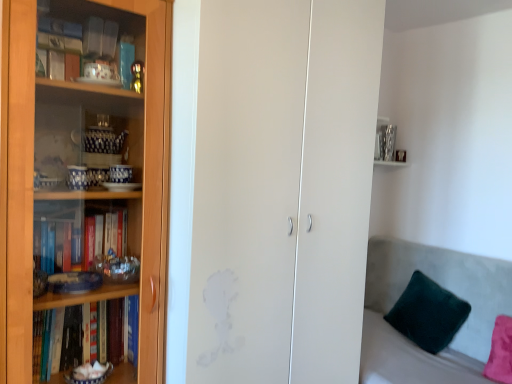
This screenshot has width=512, height=384. What do you see at coordinates (282, 189) in the screenshot?
I see `transparent glass cabinet at left` at bounding box center [282, 189].

The image size is (512, 384). I want to click on velvet grey couch at right, so click(442, 286).

Would you say velvety green pillow at lower right is inside or outside velvet grey couch at right?

velvety green pillow at lower right is located inside velvet grey couch at right.

Could you tell me if velvety green pillow at lower right is facing velvet grey couch at right?

Yes.

Looking at this image, from the image's perspective, which object appears higher, velvety green pillow at lower right or velvet grey couch at right?

From the image's view, velvety green pillow at lower right is above.

Considering the sizes of objects velvety green pillow at lower right and velvet grey couch at right in the image provided, who is thinner, velvety green pillow at lower right or velvet grey couch at right?

velvety green pillow at lower right.

Is wooden bookcase at left spatially inside velvet grey couch at right, or outside of it?

wooden bookcase at left cannot be found inside velvet grey couch at right.

Between wooden bookcase at left and velvet grey couch at right, which one has more height?

wooden bookcase at left is taller.

From the image's perspective, is wooden bookcase at left on top of velvet grey couch at right?

Yes, from the image's perspective, wooden bookcase at left is on top of velvet grey couch at right.

Which is more to the left, wooden bookcase at left or velvet grey couch at right?

From the viewer's perspective, wooden bookcase at left appears more on the left side.

From a real-world perspective, relative to velvet grey couch at right, is transparent glass cabinet at left vertically above or below?

transparent glass cabinet at left is situated higher than velvet grey couch at right in the real world.

Is transparent glass cabinet at left oriented away from velvet grey couch at right?

No, transparent glass cabinet at left is not facing away from velvet grey couch at right.

Which is nearer, (436, 283) or (217, 121)?

Clearly, point (436, 283) is more distant from the camera than point (217, 121).

Can you confirm if velvety green pillow at lower right is taller than transparent glass cabinet at left?

No, velvety green pillow at lower right is not taller than transparent glass cabinet at left.

Considering the relative sizes of velvety green pillow at lower right and transparent glass cabinet at left in the image provided, is velvety green pillow at lower right smaller than transparent glass cabinet at left?

Indeed, velvety green pillow at lower right has a smaller size compared to transparent glass cabinet at left.

Is velvety green pillow at lower right oriented towards transparent glass cabinet at left?

Yes, velvety green pillow at lower right is oriented towards transparent glass cabinet at left.

Is wooden bookcase at left wider or thinner than transparent glass cabinet at left?

In the image, wooden bookcase at left appears to be more narrow than transparent glass cabinet at left.

Based on their positions, is wooden bookcase at left located to the left or right of transparent glass cabinet at left?

Based on their positions, wooden bookcase at left is located to the left of transparent glass cabinet at left.

Which object is further away from the camera, wooden bookcase at left or transparent glass cabinet at left?

transparent glass cabinet at left is more distant.

Between point (162, 107) and point (298, 60), which one is positioned in front?

The point (162, 107) is in front.

Is velvet grey couch at right surrounding wooden bookcase at left?

Actually, wooden bookcase at left is outside velvet grey couch at right.

Does velvet grey couch at right turn towards wooden bookcase at left?

Yes, velvet grey couch at right is aimed at wooden bookcase at left.

From the image's perspective, is velvet grey couch at right over wooden bookcase at left?

No, from the image's perspective, velvet grey couch at right is not on top of wooden bookcase at left.

Considering the relative sizes of velvet grey couch at right and wooden bookcase at left in the image provided, is velvet grey couch at right taller than wooden bookcase at left?

No.

How many degrees apart are the facing directions of velvet grey couch at right and transparent glass cabinet at left?

The angular difference between velvet grey couch at right and transparent glass cabinet at left is 91.7 degrees.

Consider the image. Considering the relative sizes of velvet grey couch at right and transparent glass cabinet at left in the image provided, is velvet grey couch at right thinner than transparent glass cabinet at left?

No, velvet grey couch at right is not thinner than transparent glass cabinet at left.

I want to click on couch on the right of transparent glass cabinet at left, so click(442, 286).

Considering the sizes of objects velvet grey couch at right and transparent glass cabinet at left in the image provided, who is bigger, velvet grey couch at right or transparent glass cabinet at left?

transparent glass cabinet at left is bigger.

In order to click on couch below the velvety green pillow at lower right (from a real-world perspective) in this screenshot , I will do `click(442, 286)`.

Locate an element on the screen. This screenshot has height=384, width=512. couch located behind the wooden bookcase at left is located at coordinates (442, 286).

Which object lies further to the anchor point transparent glass cabinet at left, velvety green pillow at lower right or wooden bookcase at left?

Based on the image, velvety green pillow at lower right appears to be further to transparent glass cabinet at left.

Considering their positions, is velvety green pillow at lower right positioned closer to velvet grey couch at right than wooden bookcase at left?

Based on the image, velvety green pillow at lower right appears to be nearer to velvet grey couch at right.

Consider the image. Which object lies nearer to the anchor point wooden bookcase at left, velvety green pillow at lower right or velvet grey couch at right?

velvet grey couch at right is closer to wooden bookcase at left.

When comparing their distances from transparent glass cabinet at left, does velvet grey couch at right or wooden bookcase at left seem further?

velvet grey couch at right.

From the image, which object appears to be farther from wooden bookcase at left, velvet grey couch at right or transparent glass cabinet at left?

velvet grey couch at right is positioned further to the anchor wooden bookcase at left.

Based on their spatial positions, is velvet grey couch at right or wooden bookcase at left closer to velvety green pillow at lower right?

velvet grey couch at right is positioned closer to the anchor velvety green pillow at lower right.

Which object lies further to the anchor point transparent glass cabinet at left, velvet grey couch at right or velvety green pillow at lower right?

Based on the image, velvety green pillow at lower right appears to be further to transparent glass cabinet at left.

Which object lies nearer to the anchor point wooden bookcase at left, velvety green pillow at lower right or transparent glass cabinet at left?

The object closer to wooden bookcase at left is transparent glass cabinet at left.

This screenshot has width=512, height=384. Find the location of `glass door located between wooden bookcase at left and velvet grey couch at right in the left-right direction`. glass door located between wooden bookcase at left and velvet grey couch at right in the left-right direction is located at coordinates (282, 189).

You are a GUI agent. You are given a task and a screenshot of the screen. Output one action in this format:
    pyautogui.click(x=<x>, y=<y>)
    Task: Click on the couch located between wooden bookcase at left and velvety green pillow at lower right in the left-right direction
    
    Given the screenshot: What is the action you would take?
    pyautogui.click(x=442, y=286)

Find the location of a particular element. The height and width of the screenshot is (384, 512). glass door between wooden bookcase at left and velvety green pillow at lower right from left to right is located at coordinates (282, 189).

Where is `couch between transparent glass cabinet at left and velvety green pillow at lower right from left to right`? couch between transparent glass cabinet at left and velvety green pillow at lower right from left to right is located at coordinates (442, 286).